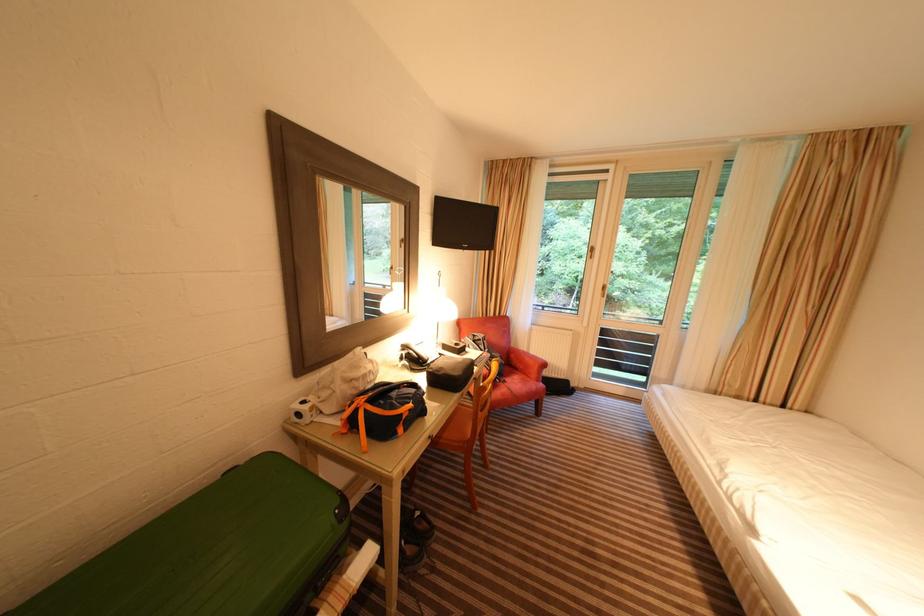
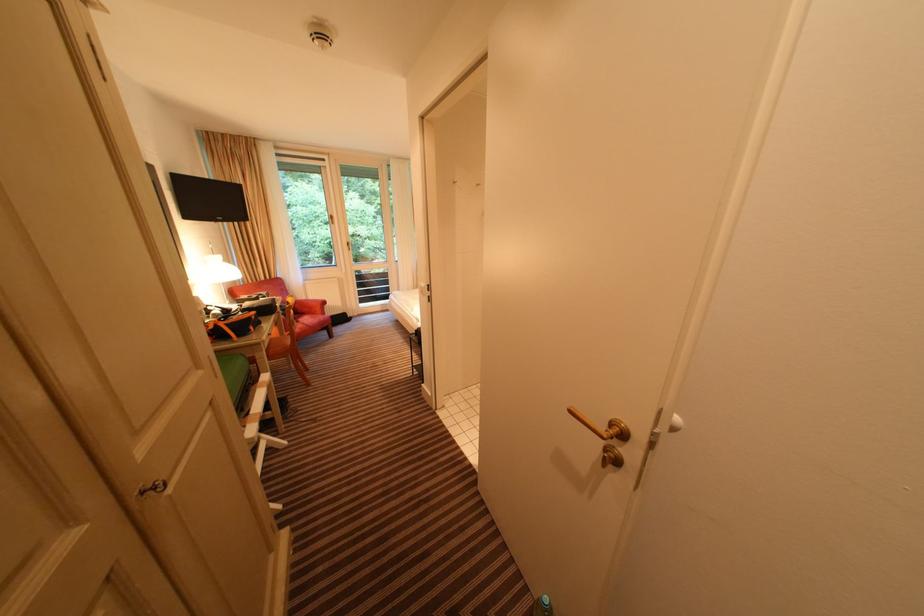
Locate, in the second image, the point that corresponds to the point at 512,384 in the first image.

(305, 323)